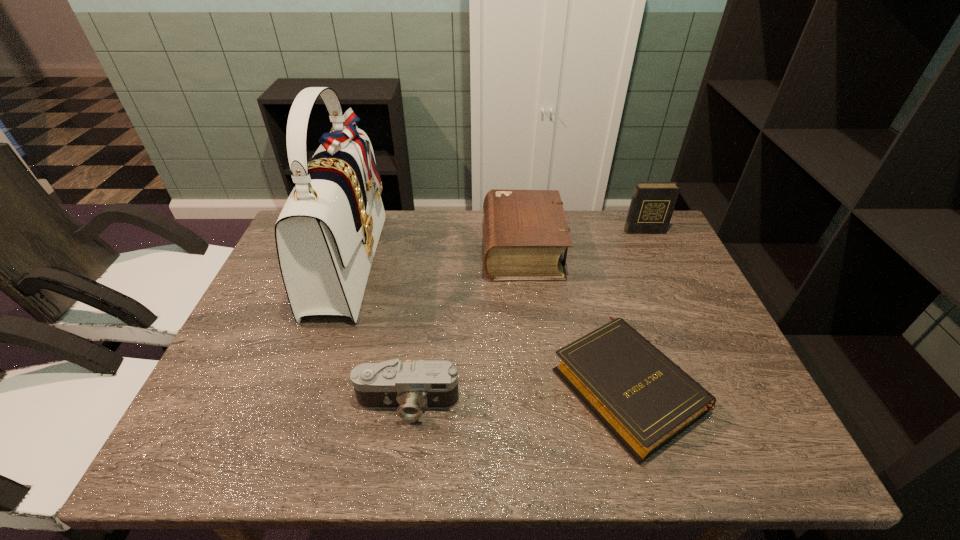
Locate an element on the screen. This screenshot has width=960, height=540. the tallest object is located at coordinates pyautogui.click(x=327, y=233).

The width and height of the screenshot is (960, 540). What are the coordinates of `satchel` in the screenshot? It's located at (327, 233).

Where is `the fourth shortest object`? the fourth shortest object is located at coordinates (652, 204).

At what (x,y) coordinates should I click in order to perform the action: click on the taller Bible. Please return your answer as a coordinate pair (x, y). This screenshot has height=540, width=960. Looking at the image, I should click on (525, 232).

The width and height of the screenshot is (960, 540). I want to click on the farther Bible, so click(525, 232).

At what (x,y) coordinates should I click in order to perform the action: click on the second shortest object. Please return your answer as a coordinate pair (x, y). This screenshot has height=540, width=960. Looking at the image, I should click on (409, 387).

Locate an element on the screen. This screenshot has width=960, height=540. camera is located at coordinates (409, 387).

Find the location of a particular element. The image size is (960, 540). the shorter Bible is located at coordinates (644, 400).

Where is `the shortest object`? the shortest object is located at coordinates (644, 400).

The height and width of the screenshot is (540, 960). In order to click on vacant space located on the front-facing side of the tallest object in this screenshot , I will do click(479, 261).